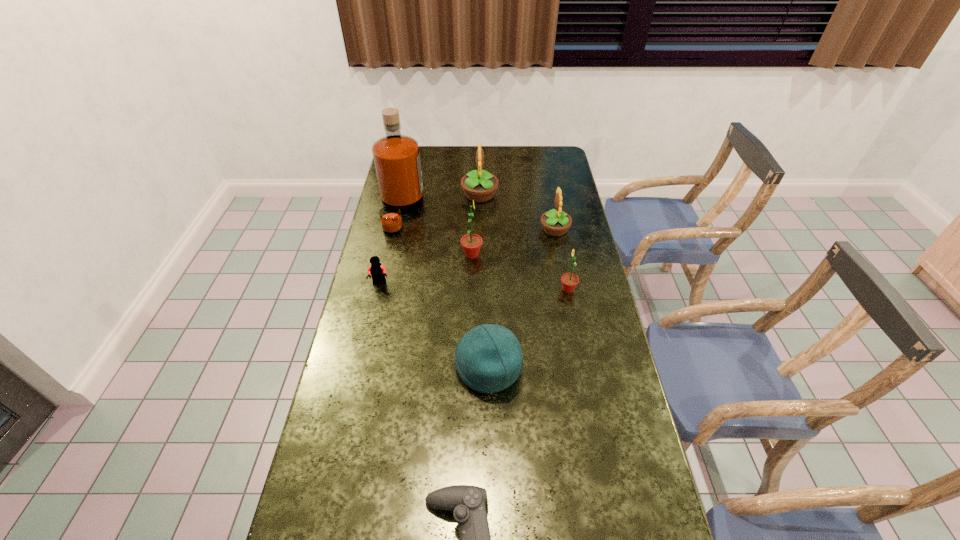
Locate an element on the screen. The image size is (960, 540). vacant space situated on the face of the smaller green sunflower is located at coordinates (488, 289).

Locate an element on the screen. free region located on the face of the smaller green sunflower is located at coordinates (464, 289).

Where is `vacant point located on the right of the sixth tallest object`? vacant point located on the right of the sixth tallest object is located at coordinates (574, 368).

Identify the location of vacant space located on the front-facing side of the Lego. (367, 341).

This screenshot has width=960, height=540. Find the location of `liquor located at the left edge`. liquor located at the left edge is located at coordinates (396, 157).

Find the location of `Lego present at the left edge`. Lego present at the left edge is located at coordinates (378, 272).

Where is `free spot at the left edge of the desktop`? free spot at the left edge of the desktop is located at coordinates (363, 430).

At what (x,y) coordinates should I click in order to perform the action: click on vacant position at the right edge of the desktop. Please return your answer as a coordinate pair (x, y). Looking at the image, I should click on (548, 191).

At what (x,y) coordinates should I click in order to perform the action: click on free location at the far left corner. Please return your answer as a coordinate pair (x, y). The height and width of the screenshot is (540, 960). Looking at the image, I should click on (424, 154).

The image size is (960, 540). In order to click on free area in between the beanie and the liquor in this screenshot , I will do `click(445, 289)`.